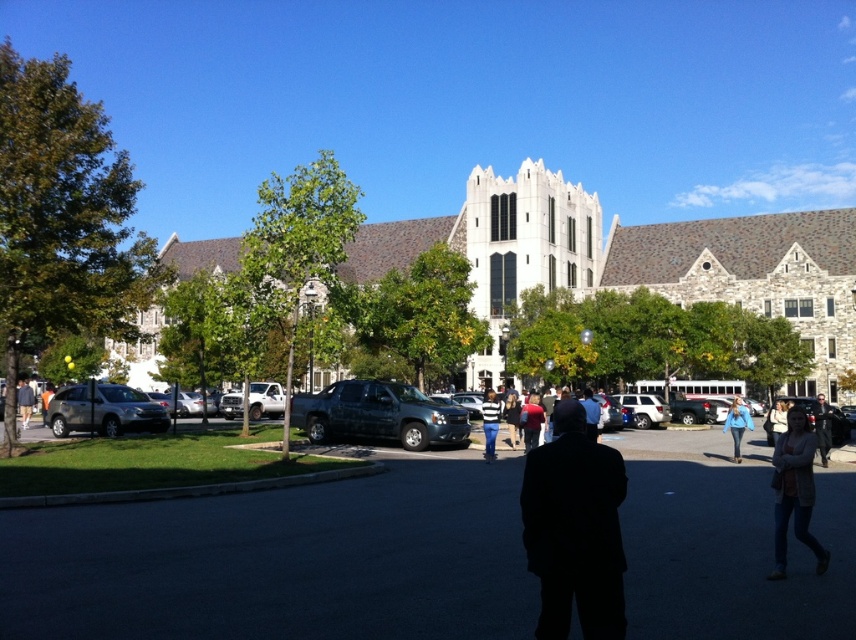
Question: Which point appears closest to the camera in this image?

Choices:
 (A) (584, 400)
 (B) (623, 396)
 (C) (19, 388)

Answer: (A)

Question: Does white stone church at center appear on the left side of matte black truck at center?

Choices:
 (A) no
 (B) yes

Answer: (A)

Question: Where is matte black truck at center located in relation to light blue denim jacket at lower right in the image?

Choices:
 (A) left
 (B) right

Answer: (B)

Question: Which point appears farthest from the camera in this image?

Choices:
 (A) (586, 432)
 (B) (633, 413)
 (C) (782, 477)

Answer: (B)

Question: Is light blue denim jacket at lower right to the left of orange fabric jacket at center from the viewer's perspective?

Choices:
 (A) no
 (B) yes

Answer: (B)

Question: Which of the following is the closest to the observer?

Choices:
 (A) orange fabric jacket at center
 (B) blue denim jeans at lower right

Answer: (B)